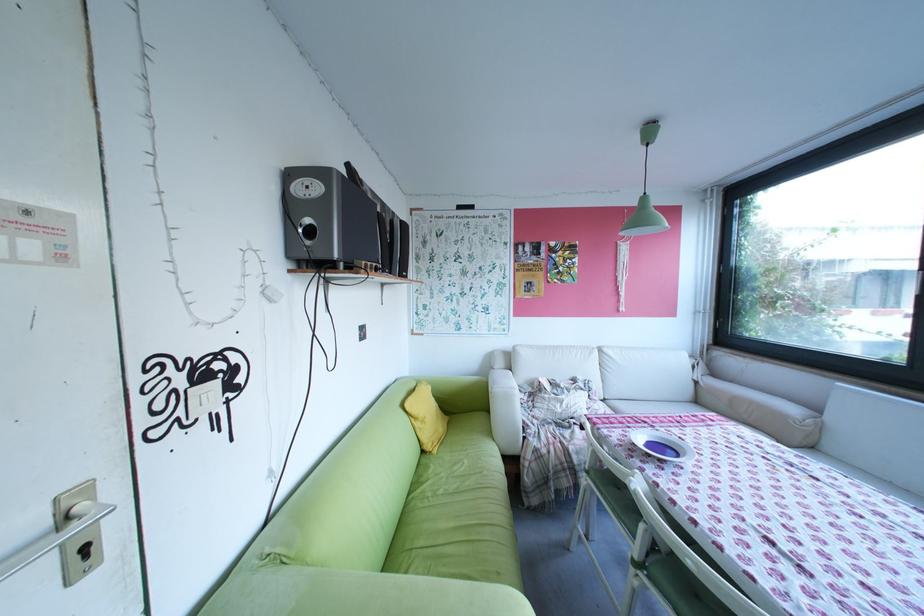
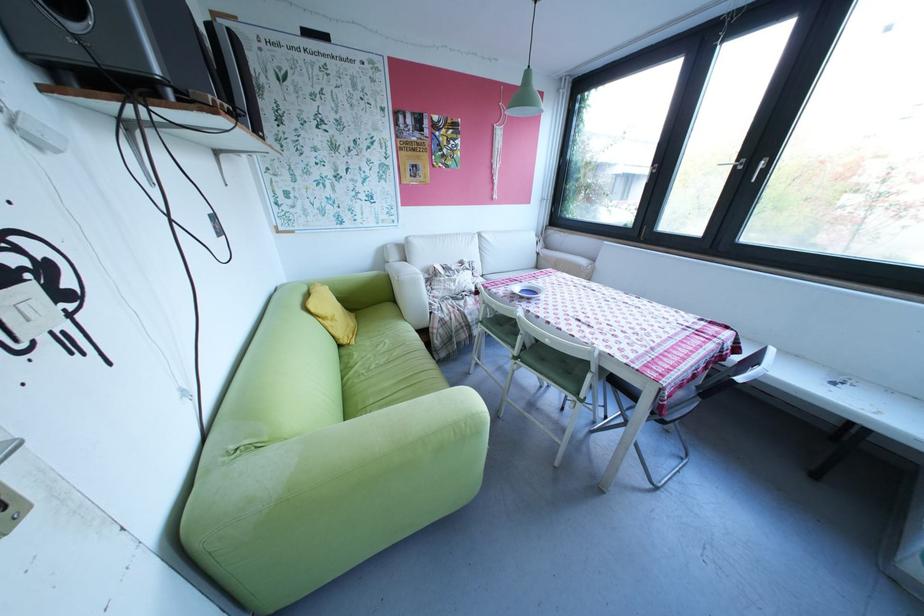
Find the pixel in the second image that matches [574,269] in the first image.

(457, 151)